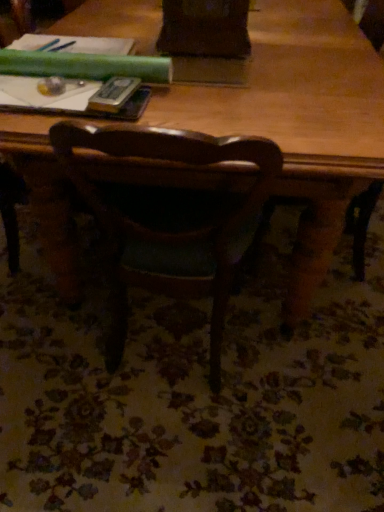
Locate an element on the screen. Image resolution: width=384 pixels, height=512 pixels. free space in front of metallic silver paperback book at upper center is located at coordinates (120, 116).